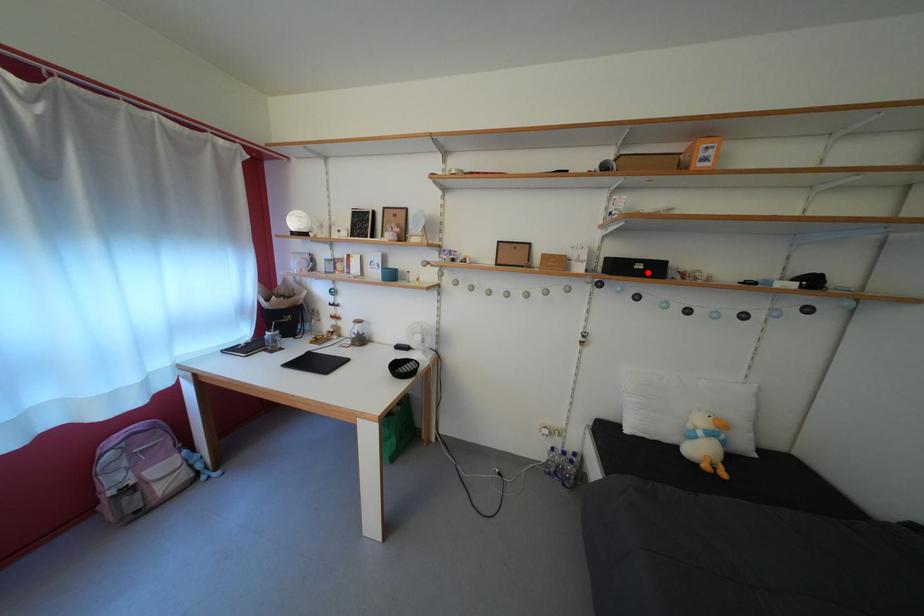
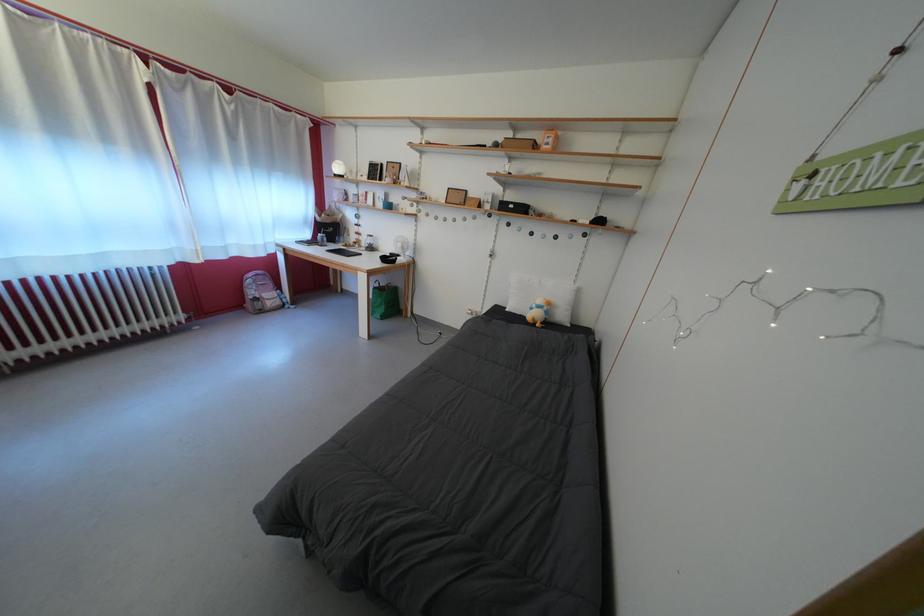
In the second image, find the point that corresponds to the highlighted location in the first image.

(519, 213)